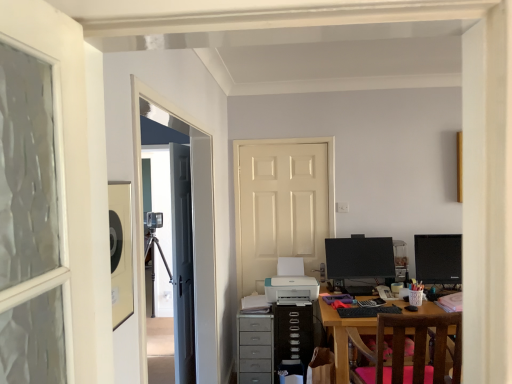
Question: Should I look upward or downward to see dark gray matte door at left, placed as the 2th door when sorted from right to left?

Choices:
 (A) down
 (B) up

Answer: (A)

Question: Does black glossy monitor at center, placed as the first computer monitor when sorted from left to right, appear on the right side of teal plastic printer at center?

Choices:
 (A) no
 (B) yes

Answer: (B)

Question: Are black glossy monitor at center, placed as the first computer monitor when sorted from left to right, and teal plastic printer at center far apart?

Choices:
 (A) yes
 (B) no

Answer: (B)

Question: Is black glossy monitor at center, placed as the first computer monitor when sorted from left to right, at the left side of teal plastic printer at center?

Choices:
 (A) no
 (B) yes

Answer: (A)

Question: Is the position of black glossy monitor at center, placed as the first computer monitor when sorted from left to right, more distant than that of teal plastic printer at center?

Choices:
 (A) no
 (B) yes

Answer: (B)

Question: Is teal plastic printer at center at the back of black glossy monitor at center, placed as the 2th computer monitor when sorted from right to left?

Choices:
 (A) yes
 (B) no

Answer: (B)

Question: Can you confirm if black glossy monitor at center, placed as the 2th computer monitor when sorted from right to left, is taller than teal plastic printer at center?

Choices:
 (A) yes
 (B) no

Answer: (A)

Question: Can you confirm if dark gray matte door at left, marked as the 1th door in a left-to-right arrangement, is positioned to the left of pink fabric chair at lower right?

Choices:
 (A) yes
 (B) no

Answer: (A)

Question: Can you confirm if dark gray matte door at left, marked as the 1th door in a left-to-right arrangement, is smaller than pink fabric chair at lower right?

Choices:
 (A) no
 (B) yes

Answer: (B)

Question: Is pink fabric chair at lower right at the back of dark gray matte door at left, placed as the 2th door when sorted from right to left?

Choices:
 (A) no
 (B) yes

Answer: (A)

Question: From the image's perspective, is dark gray matte door at left, placed as the 2th door when sorted from right to left, above pink fabric chair at lower right?

Choices:
 (A) no
 (B) yes

Answer: (B)

Question: Is dark gray matte door at left, placed as the 2th door when sorted from right to left, wider than pink fabric chair at lower right?

Choices:
 (A) yes
 (B) no

Answer: (B)

Question: Is black glossy monitor at right, the 1th computer monitor positioned from the right, directly adjacent to white glossy door at center, the first door viewed from the right?

Choices:
 (A) yes
 (B) no

Answer: (B)